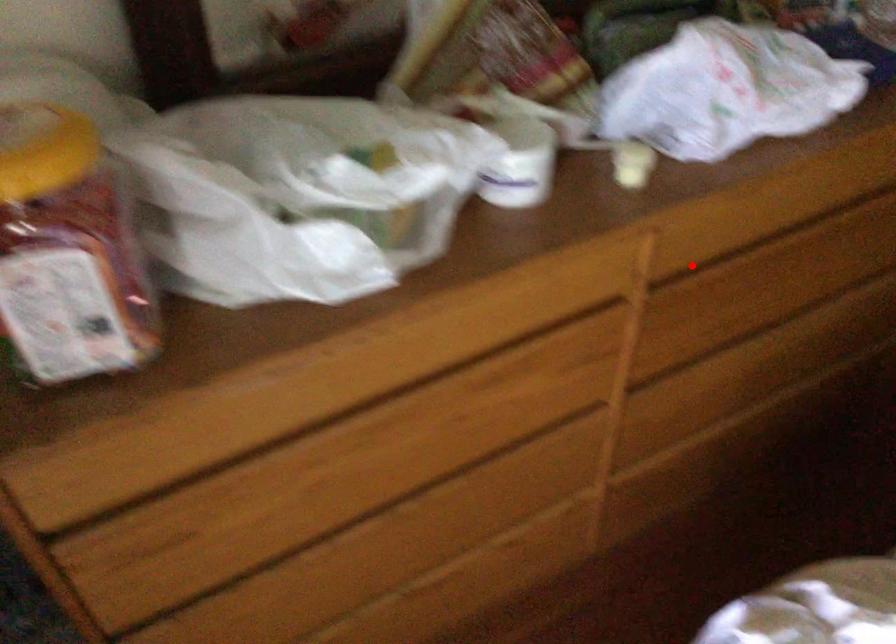
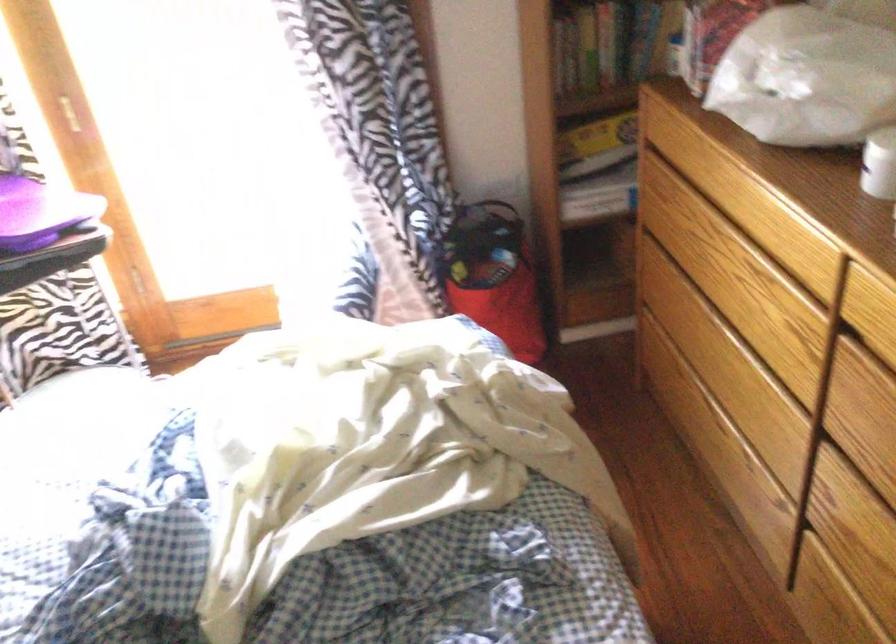
The point at the highlighted location is marked in the first image. Where is the corresponding point in the second image?

(874, 339)